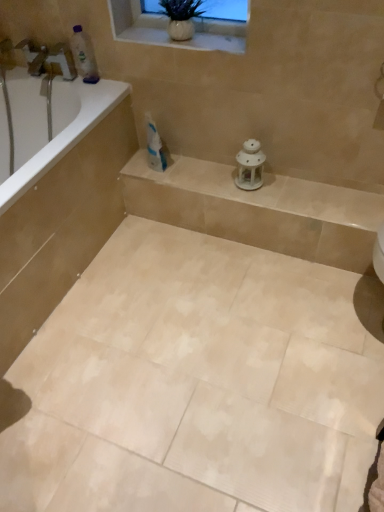
Question: Is white porcelain lantern at center placed right next to translucent plastic bottle at upper left?

Choices:
 (A) yes
 (B) no

Answer: (B)

Question: Can you confirm if white porcelain lantern at center is positioned to the left of translucent plastic bottle at upper left?

Choices:
 (A) yes
 (B) no

Answer: (B)

Question: Would you say white porcelain lantern at center is outside translucent plastic bottle at upper left?

Choices:
 (A) no
 (B) yes

Answer: (B)

Question: Is white porcelain lantern at center thinner than translucent plastic bottle at upper left?

Choices:
 (A) yes
 (B) no

Answer: (B)

Question: Does white porcelain lantern at center have a greater height compared to translucent plastic bottle at upper left?

Choices:
 (A) yes
 (B) no

Answer: (B)

Question: From a real-world perspective, is white porcelain lantern at center physically below translucent plastic bottle at upper left?

Choices:
 (A) yes
 (B) no

Answer: (A)

Question: Would you say white glossy bathtub at upper left is part of white glossy toothpaste at center's contents?

Choices:
 (A) no
 (B) yes

Answer: (A)

Question: Is white glossy toothpaste at center looking in the opposite direction of white glossy bathtub at upper left?

Choices:
 (A) no
 (B) yes

Answer: (A)

Question: Does white glossy toothpaste at center have a lesser width compared to white glossy bathtub at upper left?

Choices:
 (A) yes
 (B) no

Answer: (A)

Question: Does white glossy toothpaste at center appear on the left side of white glossy bathtub at upper left?

Choices:
 (A) no
 (B) yes

Answer: (A)

Question: Can you see white glossy toothpaste at center touching white glossy bathtub at upper left?

Choices:
 (A) yes
 (B) no

Answer: (B)

Question: Considering the relative sizes of white glossy toothpaste at center and white glossy bathtub at upper left in the image provided, is white glossy toothpaste at center wider than white glossy bathtub at upper left?

Choices:
 (A) yes
 (B) no

Answer: (B)

Question: From the image's perspective, is translucent plastic bottle at upper left on top of white ceramic vase at upper center?

Choices:
 (A) no
 (B) yes

Answer: (A)